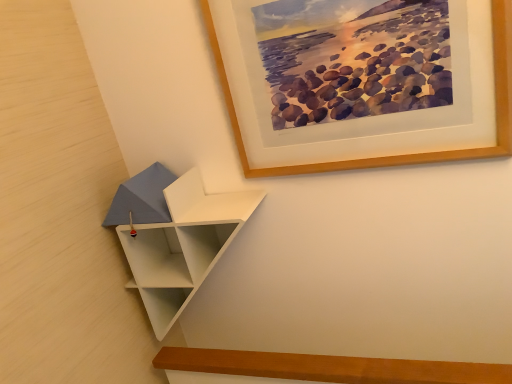
Find the location of `wooden picture frame at upper center`. wooden picture frame at upper center is located at coordinates coord(394,155).

This screenshot has height=384, width=512. What do you see at coordinates (394, 155) in the screenshot? I see `wooden picture frame at upper center` at bounding box center [394, 155].

Measure the distance between white matte/shelf at lower left and camera.

The distance of white matte/shelf at lower left from camera is 33.39 inches.

Describe the element at coordinates (174, 236) in the screenshot. The height and width of the screenshot is (384, 512). I see `white matte/shelf at lower left` at that location.

Identify the location of white matte/shelf at lower left. Image resolution: width=512 pixels, height=384 pixels. (174, 236).

Where is `wooden picture frame at upper center`? wooden picture frame at upper center is located at coordinates (394, 155).

Can you confirm if wooden picture frame at upper center is positioned to the right of white matte/shelf at lower left?

Correct, you'll find wooden picture frame at upper center to the right of white matte/shelf at lower left.

Does wooden picture frame at upper center lie in front of white matte/shelf at lower left?

A: Yes, wooden picture frame at upper center is closer to the viewer.

Which is behind, point (289, 167) or point (238, 228)?

Positioned behind is point (238, 228).

From the image's perspective, is wooden picture frame at upper center located above or below white matte/shelf at lower left?

Clearly, from the image's perspective, wooden picture frame at upper center is above white matte/shelf at lower left.

From a real-world perspective, who is located lower, wooden picture frame at upper center or white matte/shelf at lower left?

white matte/shelf at lower left, from a real-world perspective.

Which object is thinner, wooden picture frame at upper center or white matte/shelf at lower left?

With smaller width is wooden picture frame at upper center.

Which of these two, wooden picture frame at upper center or white matte/shelf at lower left, stands taller?

With more height is white matte/shelf at lower left.

Can you confirm if wooden picture frame at upper center is bigger than white matte/shelf at lower left?

No.

Is wooden picture frame at upper center completely or partially outside of white matte/shelf at lower left?

Yes, wooden picture frame at upper center is outside of white matte/shelf at lower left.

Is wooden picture frame at upper center directly adjacent to white matte/shelf at lower left?

No.

Could you tell me if wooden picture frame at upper center is turned towards white matte/shelf at lower left?

No, wooden picture frame at upper center is not aimed at white matte/shelf at lower left.

Can you tell me how much wooden picture frame at upper center and white matte/shelf at lower left differ in facing direction?

The facing directions of wooden picture frame at upper center and white matte/shelf at lower left are 2.6 degrees apart.

This screenshot has height=384, width=512. Find the location of `picture frame above the white matte/shelf at lower left (from the image's perspective)`. picture frame above the white matte/shelf at lower left (from the image's perspective) is located at coordinates (394, 155).

Looking at this image, is white matte/shelf at lower left at the right side of wooden picture frame at upper center?

No.

Considering the relative positions of white matte/shelf at lower left and wooden picture frame at upper center in the image provided, is white matte/shelf at lower left behind wooden picture frame at upper center?

Yes, white matte/shelf at lower left is further from the viewer.

Is point (220, 212) less distant than point (233, 104)?

That is True.

From the image's perspective, is white matte/shelf at lower left above or below wooden picture frame at upper center?

From the image's perspective, white matte/shelf at lower left appears below wooden picture frame at upper center.

From a real-world perspective, relative to wooden picture frame at upper center, is white matte/shelf at lower left vertically above or below?

From a real-world perspective, white matte/shelf at lower left is physically below wooden picture frame at upper center.

Between white matte/shelf at lower left and wooden picture frame at upper center, which one has larger width?

A: white matte/shelf at lower left.

Looking at this image, who is shorter, white matte/shelf at lower left or wooden picture frame at upper center?

With less height is wooden picture frame at upper center.

Between white matte/shelf at lower left and wooden picture frame at upper center, which one has smaller size?

With smaller size is wooden picture frame at upper center.

Looking at this image, which is correct: white matte/shelf at lower left is inside wooden picture frame at upper center, or outside of it?

The correct answer is: outside.

Consider the image. Is white matte/shelf at lower left not close to wooden picture frame at upper center?

Actually, white matte/shelf at lower left and wooden picture frame at upper center are a little close together.

Is white matte/shelf at lower left oriented away from wooden picture frame at upper center?

No, white matte/shelf at lower left is not facing the opposite direction of wooden picture frame at upper center.

Find the location of a particular element. The image size is (512, 384). picture frame that is above the white matte/shelf at lower left (from a real-world perspective) is located at coordinates (394, 155).

Find the location of a particular element. The width and height of the screenshot is (512, 384). shelf beneath the wooden picture frame at upper center (from a real-world perspective) is located at coordinates [x=174, y=236].

Find the location of a particular element. This screenshot has width=512, height=384. picture frame in front of the white matte/shelf at lower left is located at coordinates (394, 155).